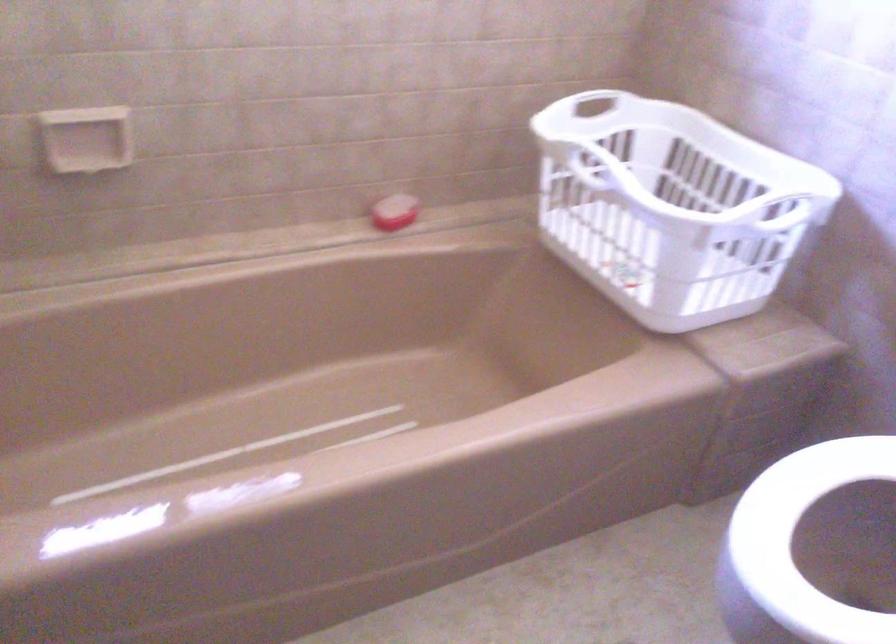
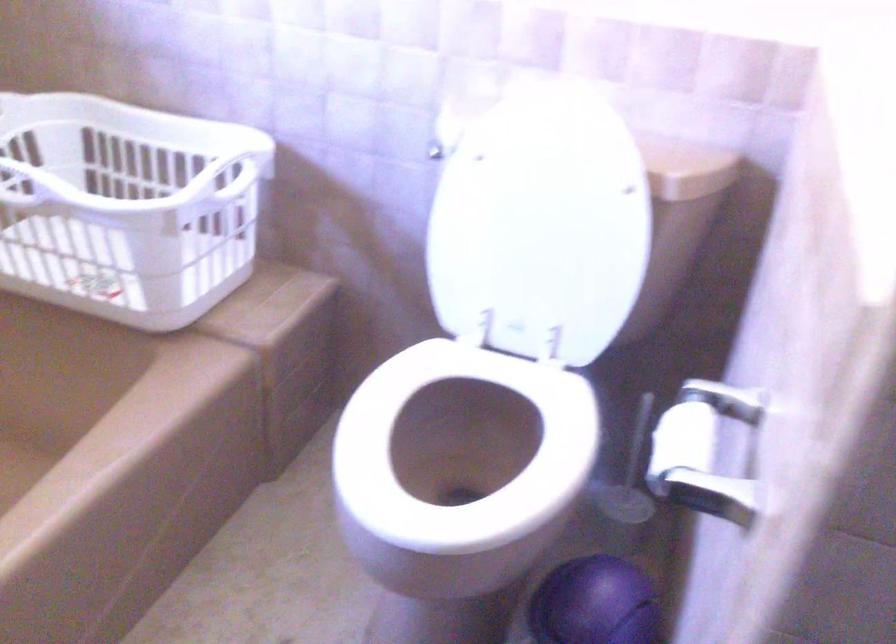
Question: I am providing you with two images of the same scene from different viewpoints. Which of the following objects are not visible in image2?

Choices:
 (A) gray trash can lid
 (B) white toilet lid
 (C) toilet lid
 (D) toilet paper roll

Answer: (C)